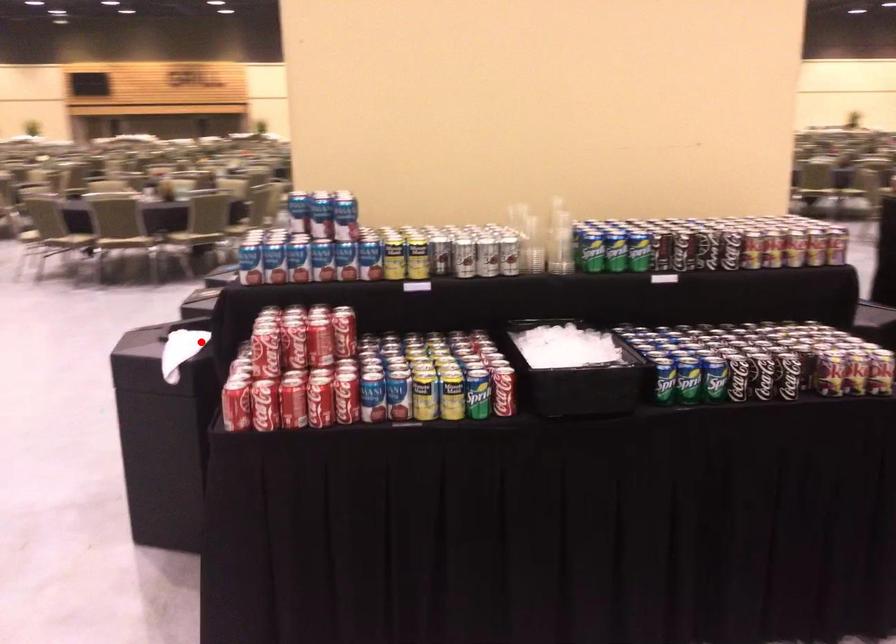
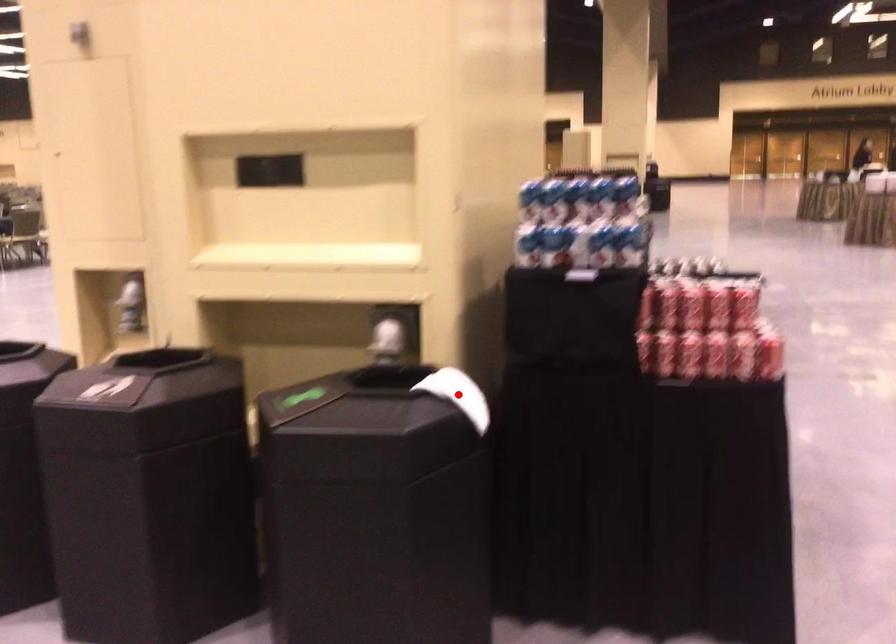
I am providing you with two images of the same scene from different viewpoints. A red point is marked on the first image and another point is marked on the second image. Does the point marked in image1 correspond to the same location as the one in image2?

Yes